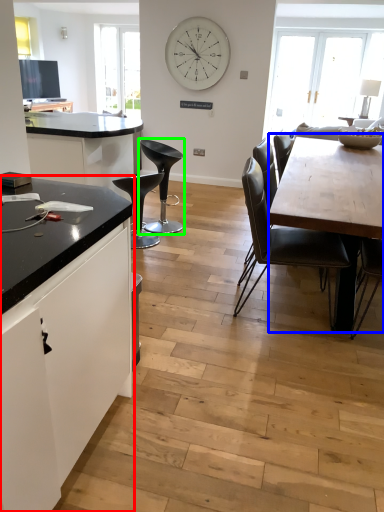
Question: Considering the real-world distances, which object is farthest from cabinetry (highlighted by a red box)? round table (highlighted by a blue box) or chair (highlighted by a green box)?

Choices:
 (A) round table
 (B) chair

Answer: (B)